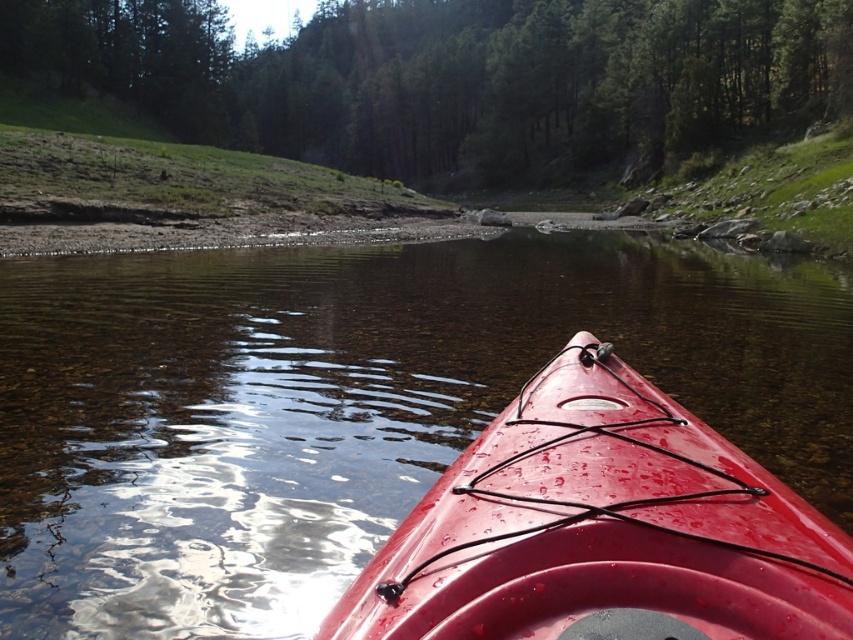
Who is positioned more to the left, transparent plastic kayak at center or glossy plastic kayak at center?

transparent plastic kayak at center

Can you confirm if transparent plastic kayak at center is shorter than glossy plastic kayak at center?

In fact, transparent plastic kayak at center may be taller than glossy plastic kayak at center.

What do you see at coordinates (349, 404) in the screenshot? I see `transparent plastic kayak at center` at bounding box center [349, 404].

Identify the location of transparent plastic kayak at center. (349, 404).